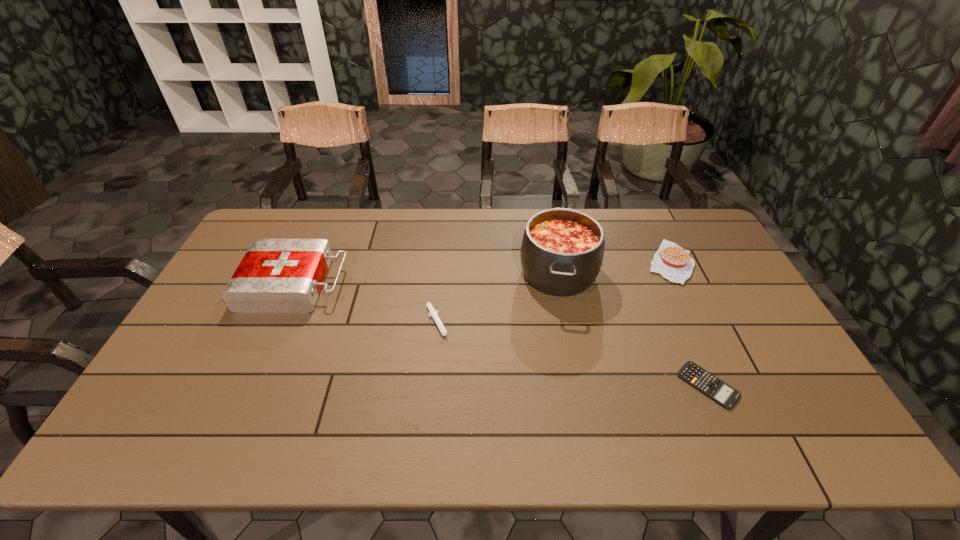
Image resolution: width=960 pixels, height=540 pixels. Identify the location of vacant space at the left edge. (204, 341).

Image resolution: width=960 pixels, height=540 pixels. I want to click on free region at the right edge, so click(711, 267).

This screenshot has width=960, height=540. Identify the location of free space at the far left corner. (276, 217).

Image resolution: width=960 pixels, height=540 pixels. Identify the location of free region at the far right corner. click(684, 249).

Find the location of a particular element. This screenshot has width=960, height=540. free space between the syringe and the first-aid kit is located at coordinates (367, 305).

Identify the location of vacant space that is in between the calculator and the second object from left to right. (573, 355).

Where is `vacant space that is in between the casserole and the third shortest object`? This screenshot has width=960, height=540. vacant space that is in between the casserole and the third shortest object is located at coordinates (614, 267).

Locate an element on the screen. vacant area that lies between the fourth object from right to left and the calculator is located at coordinates (573, 355).

You are a GUI agent. You are given a task and a screenshot of the screen. Output one action in this format:
    pyautogui.click(x=<x>, y=<y>)
    Task: Click on the vacant space in between the pie and the calculator
    The image size is (960, 540).
    Given the screenshot: What is the action you would take?
    pyautogui.click(x=689, y=323)

Where is `vacant point located between the shortest object and the pie`? vacant point located between the shortest object and the pie is located at coordinates (689, 323).